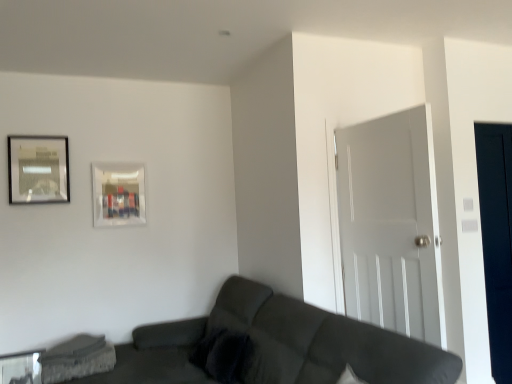
Question: Is transparent glass door at right oriented away from white matte door at right?

Choices:
 (A) yes
 (B) no

Answer: (B)

Question: Is transparent glass door at right thinner than white matte door at right?

Choices:
 (A) no
 (B) yes

Answer: (B)

Question: Considering the relative sizes of transparent glass door at right and white matte door at right in the image provided, is transparent glass door at right shorter than white matte door at right?

Choices:
 (A) no
 (B) yes

Answer: (A)

Question: From the image's perspective, is transparent glass door at right below white matte door at right?

Choices:
 (A) no
 (B) yes

Answer: (B)

Question: From a real-world perspective, is transparent glass door at right physically below white matte door at right?

Choices:
 (A) no
 (B) yes

Answer: (B)

Question: Are transparent glass door at right and white matte door at right far apart?

Choices:
 (A) no
 (B) yes

Answer: (A)

Question: Considering the relative positions of transparent glass table at lower left and transparent glass door at right in the image provided, is transparent glass table at lower left behind transparent glass door at right?

Choices:
 (A) yes
 (B) no

Answer: (A)

Question: Can you confirm if transparent glass table at lower left is smaller than transparent glass door at right?

Choices:
 (A) no
 (B) yes

Answer: (B)

Question: Is transparent glass table at lower left at the left side of transparent glass door at right?

Choices:
 (A) yes
 (B) no

Answer: (A)

Question: Does transparent glass table at lower left have a greater height compared to transparent glass door at right?

Choices:
 (A) no
 (B) yes

Answer: (A)

Question: Is transparent glass table at lower left bigger than transparent glass door at right?

Choices:
 (A) no
 (B) yes

Answer: (A)

Question: Is transparent glass table at lower left not inside transparent glass door at right?

Choices:
 (A) yes
 (B) no

Answer: (A)

Question: Is concrete textured swivel chair at lower left oriented towards dark gray fabric couch at lower center?

Choices:
 (A) no
 (B) yes

Answer: (A)